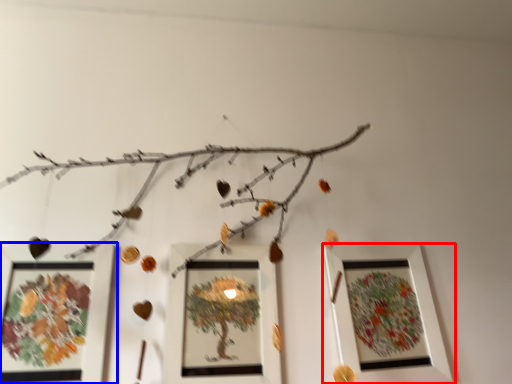
Question: Which of the following is the farthest to the observer, picture frame (highlighted by a red box) or picture frame (highlighted by a blue box)?

Choices:
 (A) picture frame
 (B) picture frame

Answer: (A)